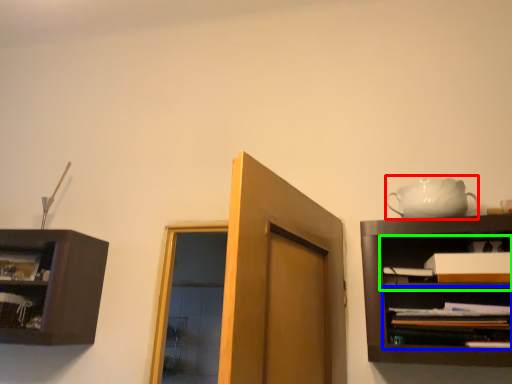
Question: Estimate the real-world distances between objects in this image. Which object is farther from tea set (highlighted by a red box), shelf (highlighted by a blue box) or cabinet (highlighted by a green box)?

Choices:
 (A) shelf
 (B) cabinet

Answer: (A)